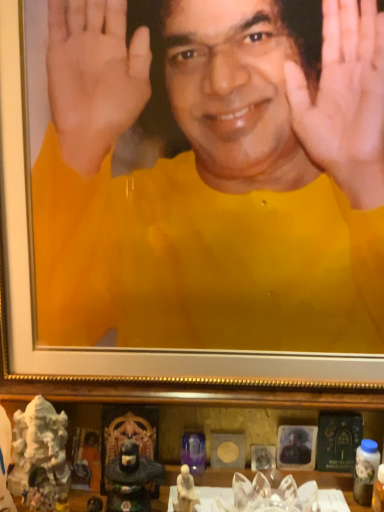
Question: From the image's perspective, is matte black portrait at lower center, placed as the first man when sorted from right to left, located above or below matte black statue at lower center?

Choices:
 (A) above
 (B) below

Answer: (A)

Question: Based on their sizes in the image, would you say matte black portrait at lower center, placed as the first man when sorted from bottom to top, is bigger or smaller than matte black statue at lower center?

Choices:
 (A) small
 (B) big

Answer: (A)

Question: Estimate the real-world distances between objects in this image. Which object is closer to the matte black portrait at lower center, the 2th man positioned from the left?

Choices:
 (A) matte black statue at lower center
 (B) yellow matte shirt at center, the 1th man positioned from the top
 (C) white porcelain statue at lower center, placed as the second toy when sorted from left to right
 (D) white marble statue at lower left, the first toy in the left-to-right sequence

Answer: (C)

Question: Which of these objects is positioned farthest from the yellow matte shirt at center, which is the second man in right-to-left order?

Choices:
 (A) white marble statue at lower left, which is the 2th toy in right-to-left order
 (B) matte black portrait at lower center, acting as the 2th man starting from the top
 (C) matte black statue at lower center
 (D) white porcelain statue at lower center, placed as the second toy when sorted from left to right

Answer: (D)